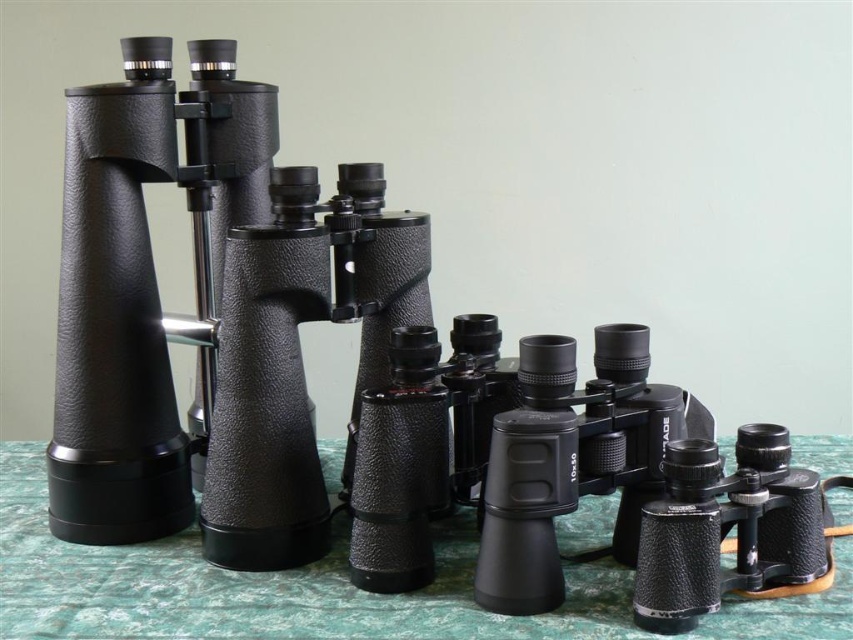
You are organizing items on a table and see the green textured tablecloth at center and the matte black binoculars at center. Which item is positioned more to the right side of the table?

The green textured tablecloth at center is positioned to the right of the matte black binoculars at center, so the tablecloth is more to the right side of the table.

You are setting up a display for an outdoor event and have the green textured tablecloth at center and the matte black binoculars at center. Which item should you place first if you want to ensure there is enough space for both on the table?

The green textured tablecloth at center should be placed first because it is larger in size than the matte black binoculars at center, ensuring there is enough space for both items on the table.